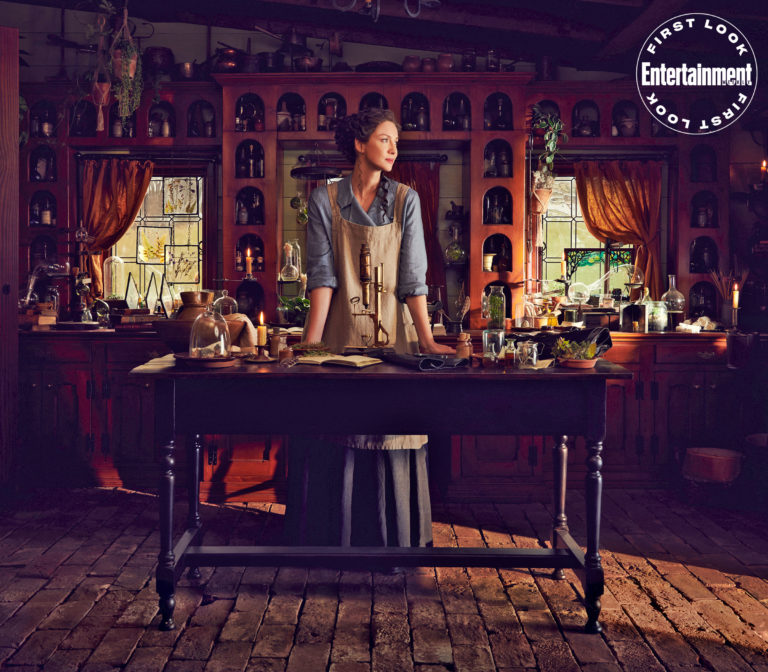
Locate an element on the screen. This screenshot has width=768, height=672. stained glass is located at coordinates (163, 241), (568, 255).